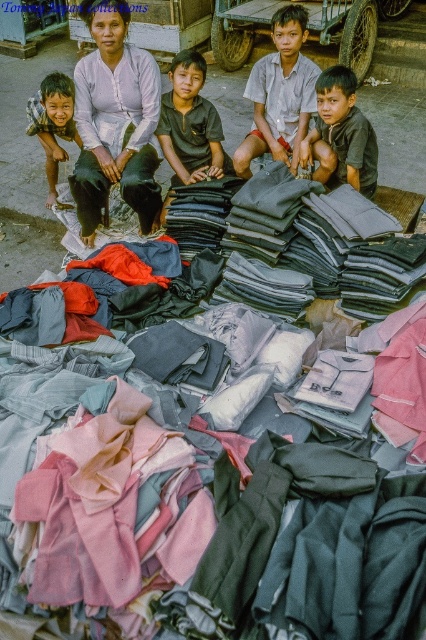
You are a tailor who needs to place a 36 inch long measuring tape between the dark brown cotton shirt at center and the dark gray cotton shirt at center. Can the measuring tape fit between them?

The dark brown cotton shirt at center and dark gray cotton shirt at center are 33.81 inches apart from each other. Since the measuring tape is 36 inches long, it cannot fully fit between them as the distance is shorter than the tape.

You are a customer at a street market and want to buy a shirt. You see two shirts in the pile of folded clothes at the center of the image. The shirts are labeled as dark brown cotton shirt at center and dark gray cotton shirt at center. Which one is taller?

The dark brown cotton shirt at center is taller than the dark gray cotton shirt at center.